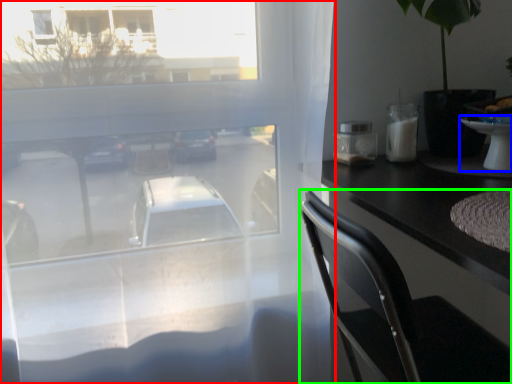
Question: Which object is the farthest from window (highlighted by a red box)? Choose among these: table (highlighted by a blue box) or chair (highlighted by a green box).

Choices:
 (A) table
 (B) chair

Answer: (A)